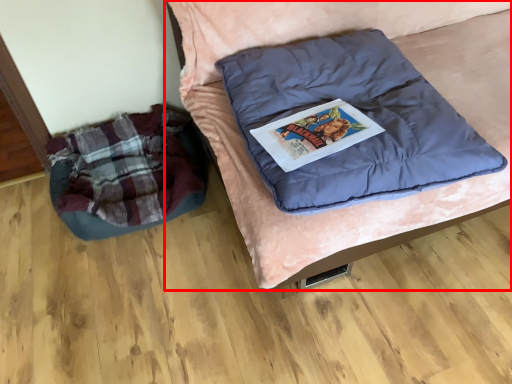
Question: From the image, what is the correct spatial relationship of furniture (annotated by the red box) in relation to bean bag chair?

Choices:
 (A) right
 (B) left

Answer: (A)